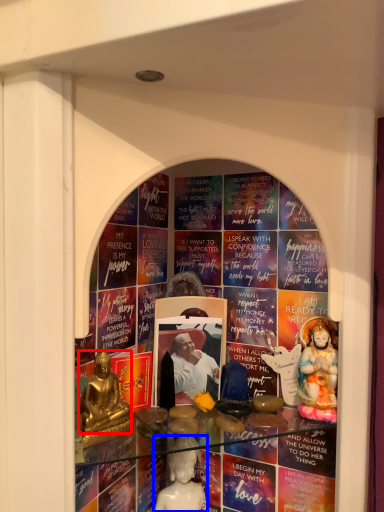
Question: Which of the following is the closest to the observer, person (highlighted by a red box) or person (highlighted by a blue box)?

Choices:
 (A) person
 (B) person

Answer: (A)